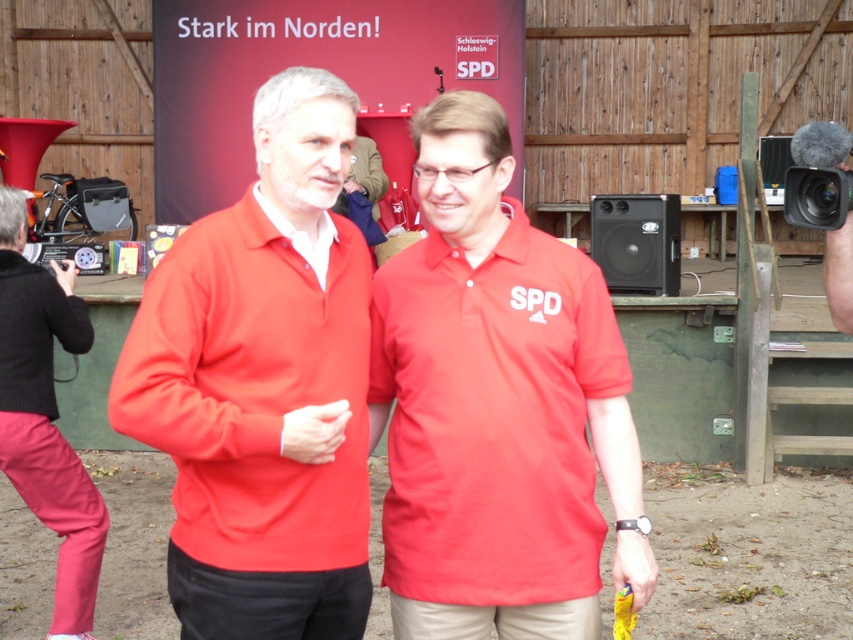
Between point (251, 232) and point (10, 392), which one is positioned in front?

Point (251, 232) is in front.

Is matte red sweater at center wider than pink cotton pants at lower left?

Yes.

Between point (306, 406) and point (48, 468), which one is positioned behind?

Positioned behind is point (48, 468).

You are a GUI agent. You are given a task and a screenshot of the screen. Output one action in this format:
    pyautogui.click(x=<x>, y=<y>)
    Task: Click on the matte red sweater at center
    This screenshot has height=640, width=853.
    Given the screenshot: What is the action you would take?
    pyautogui.click(x=263, y=385)

This screenshot has height=640, width=853. What do you see at coordinates (497, 406) in the screenshot? I see `matte red polo shirt at center` at bounding box center [497, 406].

Is matte red polo shirt at center shorter than pink cotton pants at lower left?

Correct, matte red polo shirt at center is not as tall as pink cotton pants at lower left.

Image resolution: width=853 pixels, height=640 pixels. What are the coordinates of `matte red polo shirt at center` in the screenshot? It's located at (497, 406).

Locate an element on the screen. This screenshot has width=853, height=640. matte red sweater at center is located at coordinates (263, 385).

I want to click on matte red sweater at center, so coord(263,385).